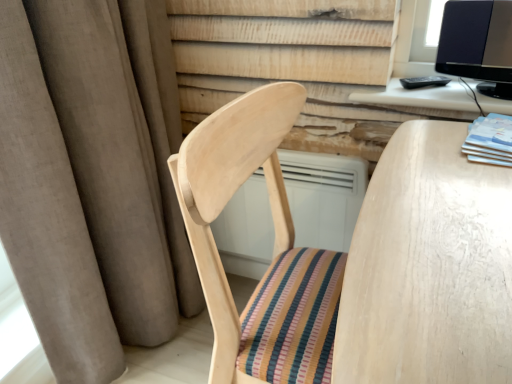
Question: Can you confirm if white wood computer desk at upper right is thinner than matte blue book at right?

Choices:
 (A) no
 (B) yes

Answer: (B)

Question: Does white wood computer desk at upper right appear on the right side of matte blue book at right?

Choices:
 (A) yes
 (B) no

Answer: (B)

Question: Considering the relative sizes of white wood computer desk at upper right and matte blue book at right in the image provided, is white wood computer desk at upper right wider than matte blue book at right?

Choices:
 (A) no
 (B) yes

Answer: (A)

Question: Is white wood computer desk at upper right bigger than matte blue book at right?

Choices:
 (A) no
 (B) yes

Answer: (B)

Question: Are white wood computer desk at upper right and matte blue book at right beside each other?

Choices:
 (A) yes
 (B) no

Answer: (B)

Question: Is white wood computer desk at upper right situated inside brown fabric curtain at left or outside?

Choices:
 (A) outside
 (B) inside

Answer: (A)

Question: Does point coord(421,96) appear closer or farther from the camera than point coord(102,263)?

Choices:
 (A) closer
 (B) farther

Answer: (A)

Question: Relative to brown fabric curtain at left, is white wood computer desk at upper right in front or behind?

Choices:
 (A) behind
 (B) front

Answer: (A)

Question: Is white wood computer desk at upper right taller or shorter than brown fabric curtain at left?

Choices:
 (A) short
 (B) tall

Answer: (A)

Question: Is brown fabric curtain at left inside or outside of white wood computer desk at upper right?

Choices:
 (A) outside
 (B) inside

Answer: (A)

Question: Considering the positions of brown fabric curtain at left and white wood computer desk at upper right in the image, is brown fabric curtain at left taller or shorter than white wood computer desk at upper right?

Choices:
 (A) short
 (B) tall

Answer: (B)

Question: From the image's perspective, is brown fabric curtain at left above or below white wood computer desk at upper right?

Choices:
 (A) below
 (B) above

Answer: (A)

Question: From a real-world perspective, relative to white wood computer desk at upper right, is brown fabric curtain at left vertically above or below?

Choices:
 (A) below
 (B) above

Answer: (A)

Question: Choose the correct answer: Is matte blue book at right inside brown fabric curtain at left or outside it?

Choices:
 (A) outside
 (B) inside

Answer: (A)

Question: From their relative heights in the image, would you say matte blue book at right is taller or shorter than brown fabric curtain at left?

Choices:
 (A) tall
 (B) short

Answer: (B)